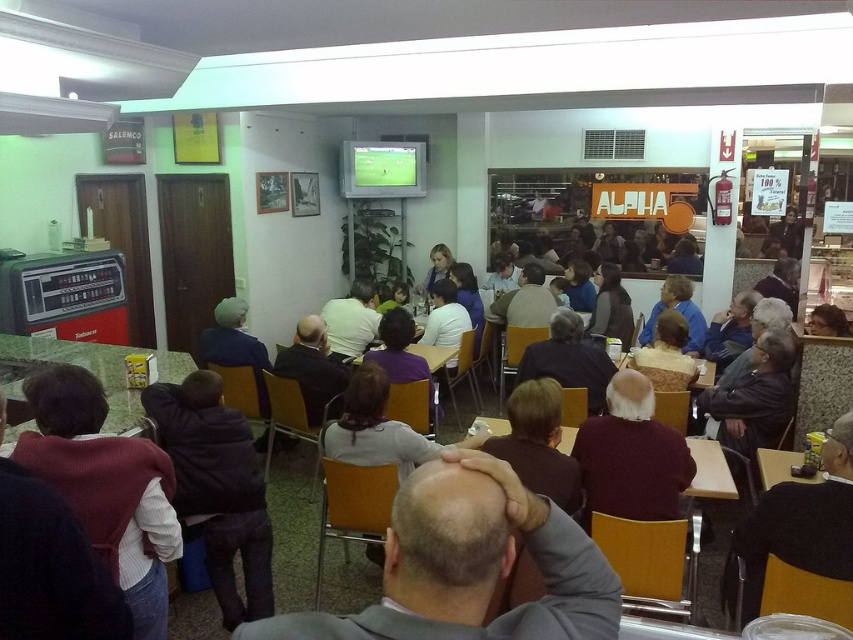
You are a delivery person trying to place a package on the table. The package is 36 inches long. The point where you want to place the package is at point (473, 624). Can you fit the package horizontally on the table?

The distance between the points is 35.57 inches, which is less than the package length of 36 inches. Therefore, the package cannot be placed horizontally on the table.